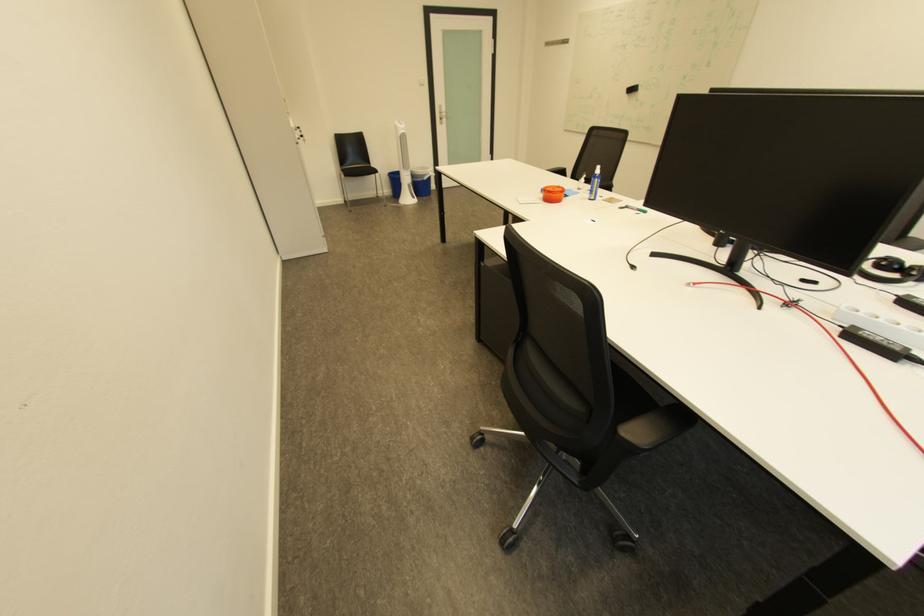
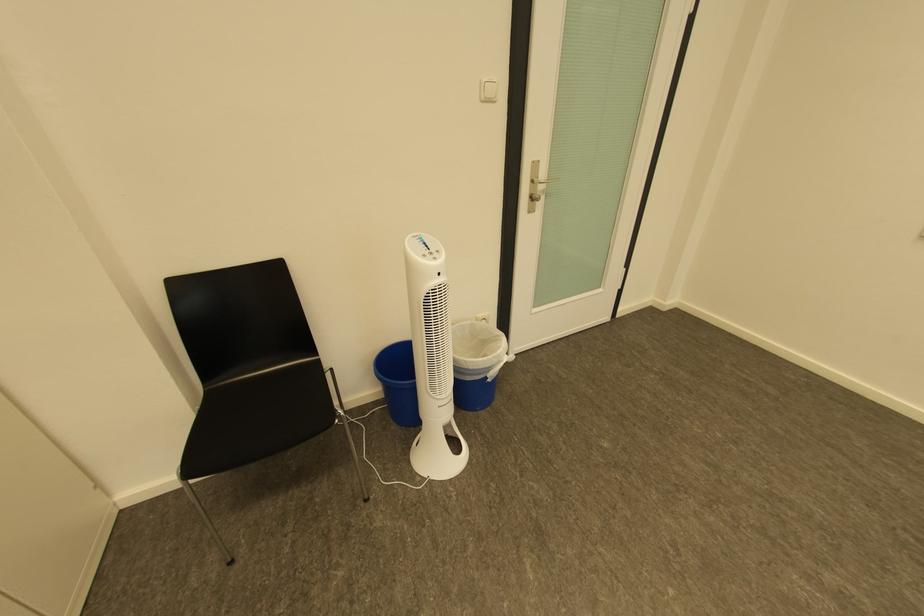
The point at (434, 177) is marked in the first image. Where is the corresponding point in the second image?

(499, 370)